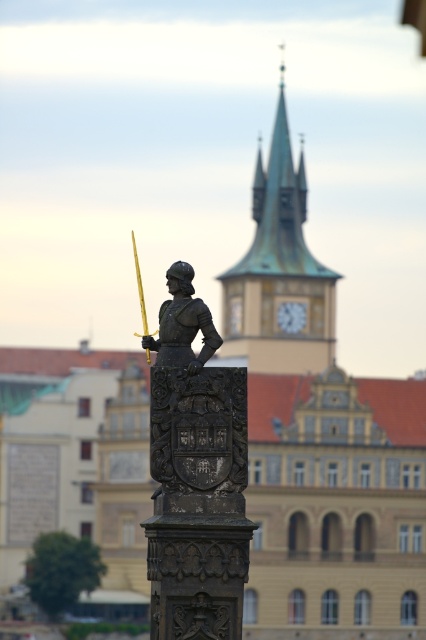
Question: Can you confirm if metallic clock face at center is bigger than gold metallic sword at center?

Choices:
 (A) yes
 (B) no

Answer: (B)

Question: Which of the following is the farthest from the observer?

Choices:
 (A) (175, 572)
 (B) (299, 317)
 (C) (307, 253)
 (D) (134, 244)

Answer: (D)

Question: Among these objects, which one is nearest to the camera?

Choices:
 (A) metallic clock face at center
 (B) green copper tower at upper center
 (C) gold metallic sword at center
 (D) polished bronze statue at center

Answer: (D)

Question: Which of the following is the closest to the observer?

Choices:
 (A) green copper tower at upper center
 (B) gold metallic sword at center

Answer: (B)

Question: Can you confirm if green copper tower at upper center is wider than gold metallic sword at center?

Choices:
 (A) yes
 (B) no

Answer: (A)

Question: Does green copper tower at upper center appear over gold metallic sword at center?

Choices:
 (A) yes
 (B) no

Answer: (A)